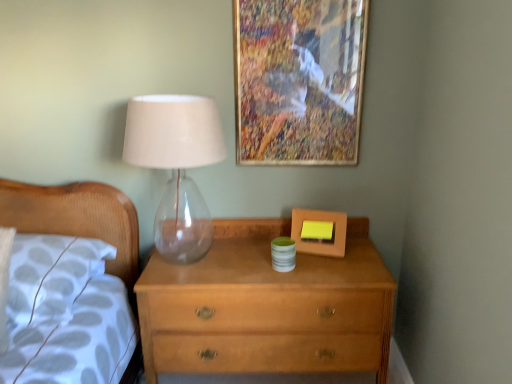
The image size is (512, 384). Describe the element at coordinates (50, 276) in the screenshot. I see `white fabric pillow at left` at that location.

In order to click on transparent glass table lamp at left in this screenshot , I will do `click(176, 165)`.

What are the coordinates of `wooden picture frame at upper center, which appears as the 2th picture frame when ordered from the bottom` in the screenshot? It's located at (298, 80).

What is the approximate height of light brown wood chest of drawers at center?

27.87 inches.

You are a GUI agent. You are given a task and a screenshot of the screen. Output one action in this format:
    pyautogui.click(x=<x>, y=<y>)
    Task: Click on the white fabric pillow at left
    This screenshot has height=384, width=512.
    Given the screenshot: What is the action you would take?
    (50, 276)

Is wooden picture frame at upper center, the 1th picture frame viewed from the top, wider than light brown wood chest of drawers at center?

No.

The height and width of the screenshot is (384, 512). What are the coordinates of `the chest of drawers that appears below the wooden picture frame at upper center, which appears as the 2th picture frame when ordered from the bottom (from the image's perspective)` in the screenshot? It's located at (267, 307).

How many degrees apart are the facing directions of wooden picture frame at upper center, which appears as the 2th picture frame when ordered from the bottom, and light brown wood chest of drawers at center?

0.962 degrees.

Is wooden picture frame at upper center, the 1th picture frame viewed from the top, oriented towards light brown wood chest of drawers at center?

No, wooden picture frame at upper center, the 1th picture frame viewed from the top, is not oriented towards light brown wood chest of drawers at center.

From the image's perspective, is matte wooden picture frame at center, which is counted as the first picture frame, starting from the bottom, under light brown wood chest of drawers at center?

No, from the image's perspective, matte wooden picture frame at center, which is counted as the first picture frame, starting from the bottom, is not beneath light brown wood chest of drawers at center.

Is matte wooden picture frame at center, which is counted as the first picture frame, starting from the bottom, outside of light brown wood chest of drawers at center?

That's correct, matte wooden picture frame at center, which is counted as the first picture frame, starting from the bottom, is outside of light brown wood chest of drawers at center.

Looking at the image, does matte wooden picture frame at center, which is counted as the first picture frame, starting from the bottom, seem bigger or smaller compared to light brown wood chest of drawers at center?

Clearly, matte wooden picture frame at center, which is counted as the first picture frame, starting from the bottom, is smaller in size than light brown wood chest of drawers at center.

Could matte wooden picture frame at center, the 2th picture frame in the top-to-bottom sequence, be considered to be inside light brown wood chest of drawers at center?

Actually, matte wooden picture frame at center, the 2th picture frame in the top-to-bottom sequence, is outside light brown wood chest of drawers at center.

Is light brown wood chest of drawers at center turned away from matte wooden picture frame at center, which is counted as the first picture frame, starting from the bottom?

No, light brown wood chest of drawers at center is not facing away from matte wooden picture frame at center, which is counted as the first picture frame, starting from the bottom.

Between point (229, 241) and point (298, 243), which one is positioned in front?

Point (298, 243)

Where is `the chest of drawers in front of the matte wooden picture frame at center, the 2th picture frame in the top-to-bottom sequence`? The width and height of the screenshot is (512, 384). the chest of drawers in front of the matte wooden picture frame at center, the 2th picture frame in the top-to-bottom sequence is located at coordinates (267, 307).

Can you confirm if matte wooden picture frame at center, which is counted as the first picture frame, starting from the bottom, is smaller than white fabric pillow at left?

Yes, matte wooden picture frame at center, which is counted as the first picture frame, starting from the bottom, is smaller than white fabric pillow at left.

Is matte wooden picture frame at center, the 2th picture frame in the top-to-bottom sequence, far from white fabric pillow at left?

No, there isn't a large distance between matte wooden picture frame at center, the 2th picture frame in the top-to-bottom sequence, and white fabric pillow at left.

Is point (339, 252) positioned in front of point (7, 308)?

That is False.

Is matte wooden picture frame at center, which is counted as the first picture frame, starting from the bottom, positioned before white fabric pillow at left?

That is False.

Which is behind, white fabric pillow at left or wooden picture frame at upper center, the 1th picture frame viewed from the top?

wooden picture frame at upper center, the 1th picture frame viewed from the top, is further away from the camera.

From a real-world perspective, is white fabric pillow at left physically above wooden picture frame at upper center, which appears as the 2th picture frame when ordered from the bottom?

No, from a real-world perspective, white fabric pillow at left is not on top of wooden picture frame at upper center, which appears as the 2th picture frame when ordered from the bottom.

Considering the sizes of objects white fabric pillow at left and wooden picture frame at upper center, which appears as the 2th picture frame when ordered from the bottom, in the image provided, who is thinner, white fabric pillow at left or wooden picture frame at upper center, which appears as the 2th picture frame when ordered from the bottom,?

wooden picture frame at upper center, which appears as the 2th picture frame when ordered from the bottom, is thinner.

Is transparent glass table lamp at left located within wooden picture frame at upper center, the 1th picture frame viewed from the top?

No, transparent glass table lamp at left is not inside wooden picture frame at upper center, the 1th picture frame viewed from the top.

Starting from the transparent glass table lamp at left, which picture frame is the 1st one to the right? Please provide its 2D coordinates.

[(298, 80)]

Considering the sizes of objects wooden picture frame at upper center, the 1th picture frame viewed from the top, and transparent glass table lamp at left in the image provided, who is wider, wooden picture frame at upper center, the 1th picture frame viewed from the top, or transparent glass table lamp at left?

transparent glass table lamp at left.

Is matte wooden picture frame at center, which is counted as the first picture frame, starting from the bottom, inside transparent glass table lamp at left?

No, transparent glass table lamp at left does not contain matte wooden picture frame at center, which is counted as the first picture frame, starting from the bottom.

Is transparent glass table lamp at left oriented away from matte wooden picture frame at center, the 2th picture frame in the top-to-bottom sequence?

No, transparent glass table lamp at left's orientation is not away from matte wooden picture frame at center, the 2th picture frame in the top-to-bottom sequence.

Does point (169, 221) come closer to viewer compared to point (324, 214)?

No, (169, 221) is behind (324, 214).

Is transparent glass table lamp at left wider than matte wooden picture frame at center, the 2th picture frame in the top-to-bottom sequence?

Yes, transparent glass table lamp at left is wider than matte wooden picture frame at center, the 2th picture frame in the top-to-bottom sequence.

Which picture frame is the 1st one when counting from the back of the light brown wood chest of drawers at center? Please provide its 2D coordinates.

[(298, 80)]

The height and width of the screenshot is (384, 512). Find the location of `the chest of drawers directly beneath the matte wooden picture frame at center, the 2th picture frame in the top-to-bottom sequence (from a real-world perspective)`. the chest of drawers directly beneath the matte wooden picture frame at center, the 2th picture frame in the top-to-bottom sequence (from a real-world perspective) is located at coordinates (267, 307).

Estimate the real-world distances between objects in this image. Which object is closer to white fabric pillow at left, matte wooden picture frame at center, which is counted as the first picture frame, starting from the bottom, or light brown wood chest of drawers at center?

Among the two, light brown wood chest of drawers at center is located nearer to white fabric pillow at left.

Looking at the image, which one is located further to wooden picture frame at upper center, which appears as the 2th picture frame when ordered from the bottom, transparent glass table lamp at left or light brown wood chest of drawers at center?

light brown wood chest of drawers at center is positioned further to the anchor wooden picture frame at upper center, which appears as the 2th picture frame when ordered from the bottom.

When comparing their distances from transparent glass table lamp at left, does wooden picture frame at upper center, which appears as the 2th picture frame when ordered from the bottom, or light brown wood chest of drawers at center seem closer?

wooden picture frame at upper center, which appears as the 2th picture frame when ordered from the bottom, lies closer to transparent glass table lamp at left than the other object.

When comparing their distances from matte wooden picture frame at center, which is counted as the first picture frame, starting from the bottom, does transparent glass table lamp at left or wooden picture frame at upper center, which appears as the 2th picture frame when ordered from the bottom, seem further?

→ Among the two, transparent glass table lamp at left is located further to matte wooden picture frame at center, which is counted as the first picture frame, starting from the bottom.

Considering their positions, is transparent glass table lamp at left positioned further to light brown wood chest of drawers at center than white fabric pillow at left?

transparent glass table lamp at left is further to light brown wood chest of drawers at center.

From the image, which object appears to be nearer to matte wooden picture frame at center, the 2th picture frame in the top-to-bottom sequence, wooden picture frame at upper center, the 1th picture frame viewed from the top, or transparent glass table lamp at left?

wooden picture frame at upper center, the 1th picture frame viewed from the top, lies closer to matte wooden picture frame at center, the 2th picture frame in the top-to-bottom sequence, than the other object.

Looking at the image, which one is located closer to transparent glass table lamp at left, matte wooden picture frame at center, which is counted as the first picture frame, starting from the bottom, or wooden picture frame at upper center, the 1th picture frame viewed from the top?

wooden picture frame at upper center, the 1th picture frame viewed from the top, lies closer to transparent glass table lamp at left than the other object.

Looking at the image, which one is located further to white fabric pillow at left, matte wooden picture frame at center, which is counted as the first picture frame, starting from the bottom, or wooden picture frame at upper center, which appears as the 2th picture frame when ordered from the bottom?

wooden picture frame at upper center, which appears as the 2th picture frame when ordered from the bottom, is positioned further to the anchor white fabric pillow at left.

Find the location of a particular element. The width and height of the screenshot is (512, 384). picture frame between wooden picture frame at upper center, the 1th picture frame viewed from the top, and light brown wood chest of drawers at center from top to bottom is located at coordinates (320, 220).

The height and width of the screenshot is (384, 512). What are the coordinates of `table lamp located between white fabric pillow at left and light brown wood chest of drawers at center in the left-right direction` in the screenshot? It's located at (176, 165).

You are a GUI agent. You are given a task and a screenshot of the screen. Output one action in this format:
    pyautogui.click(x=<x>, y=<y>)
    Task: Click on the table lamp between wooden picture frame at upper center, the 1th picture frame viewed from the top, and light brown wood chest of drawers at center vertically
    
    Given the screenshot: What is the action you would take?
    pyautogui.click(x=176, y=165)

Where is `picture frame between white fabric pillow at left and matte wooden picture frame at center, the 2th picture frame in the top-to-bottom sequence`? picture frame between white fabric pillow at left and matte wooden picture frame at center, the 2th picture frame in the top-to-bottom sequence is located at coordinates (298, 80).